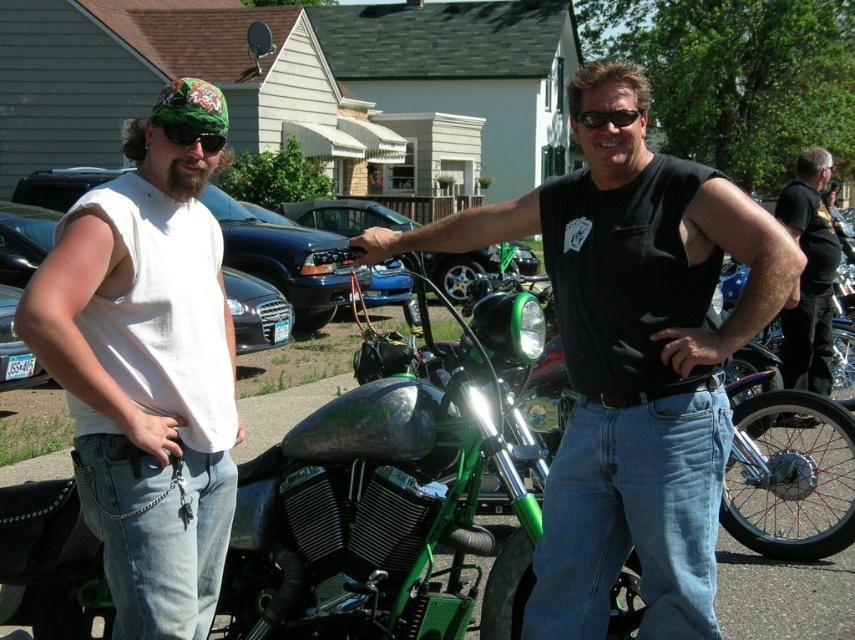
You are a photographer at the event and want to take a photo of the black leather jacket at upper right and the black plastic sunglasses at upper center. Which object should you zoom in on to capture more details?

The black plastic sunglasses at upper center should be zoomed in on because it is smaller than the black leather jacket at upper right, so zooming in on the smaller object would allow for more detailed capture.

Based on the photo, you are a photographer trying to capture a closeup of the black plastic sunglasses at upper center while also including the black leather jacket at upper right in the frame. Based on their positions, can you tell if the jacket is positioned lower than the sunglasses?

The black leather jacket at upper right is below black plastic sunglasses at upper center, so yes, the jacket is positioned lower than the sunglasses.